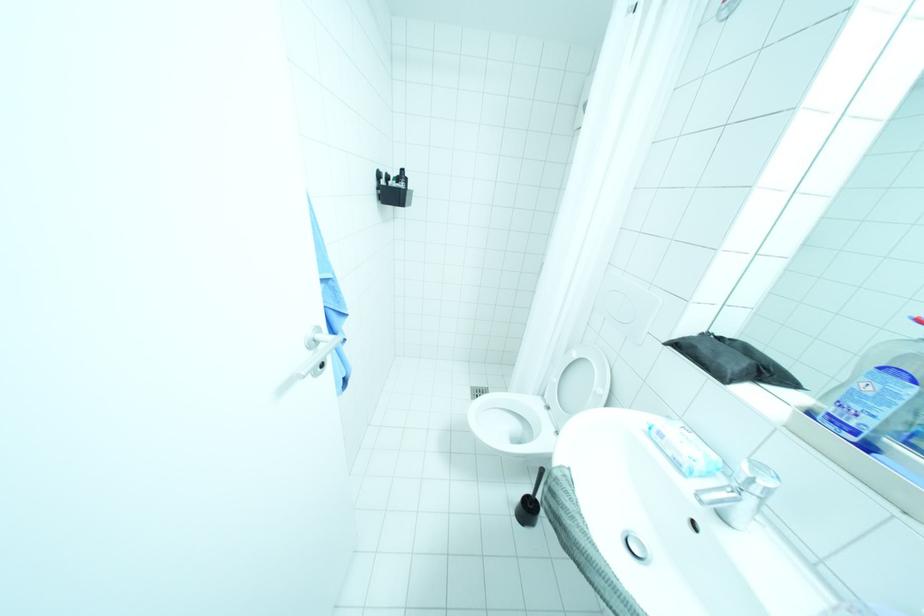
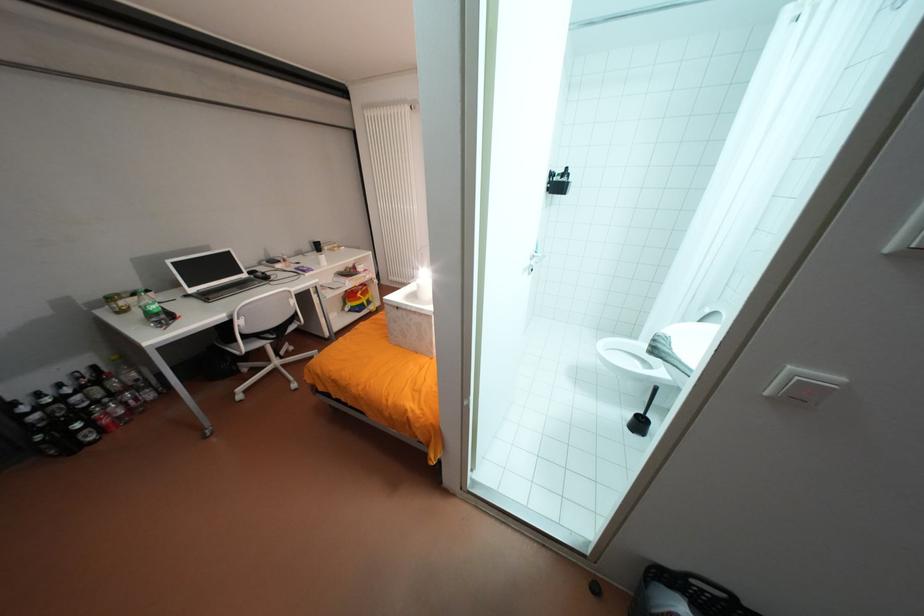
The point at (521, 512) is marked in the first image. Where is the corresponding point in the second image?

(634, 423)